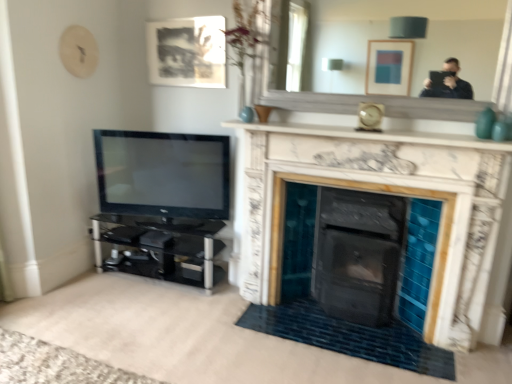
Question: Considering the positions of matte black picture frame at upper center and black glass entertainment center at left in the image, is matte black picture frame at upper center taller or shorter than black glass entertainment center at left?

Choices:
 (A) short
 (B) tall

Answer: (B)

Question: Choose the correct answer: Is matte black picture frame at upper center inside black glass entertainment center at left or outside it?

Choices:
 (A) inside
 (B) outside

Answer: (B)

Question: Which object is positioned closest to the black glossy tv at left?

Choices:
 (A) matte black picture frame at upper center
 (B) black glass entertainment center at left
 (C) white marble fireplace at center
 (D) white marble mirror at upper center
 (E) white marble fireplace at upper center

Answer: (B)

Question: Considering the real-world distances, which object is closest to the white marble fireplace at upper center?

Choices:
 (A) white marble fireplace at center
 (B) white marble mirror at upper center
 (C) black glass entertainment center at left
 (D) black glossy tv at left
 (E) matte black picture frame at upper center

Answer: (A)